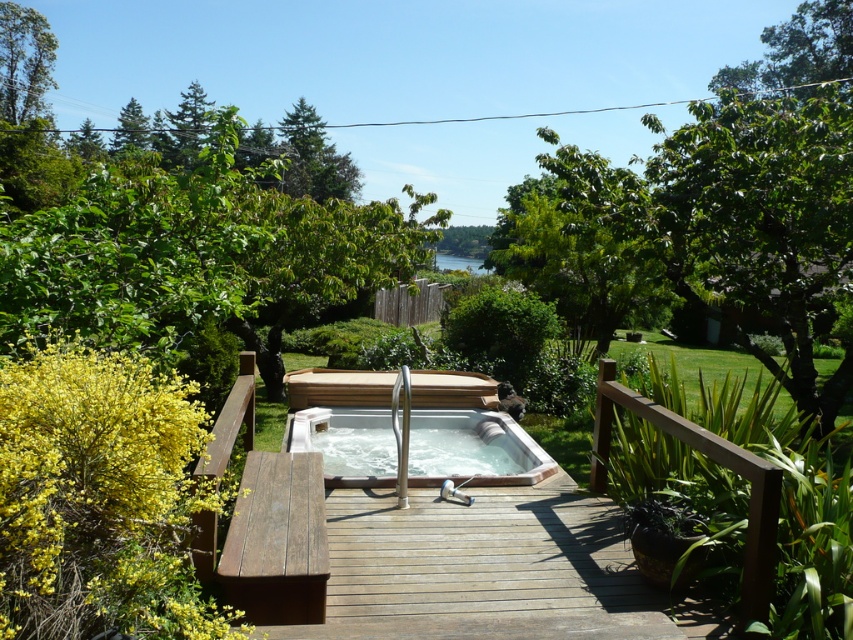
Can you confirm if brown wooden deck at center is taller than white glossy hot tub at center?

Correct, brown wooden deck at center is much taller as white glossy hot tub at center.

Locate an element on the screen. This screenshot has width=853, height=640. brown wooden deck at center is located at coordinates coord(413,560).

Which is behind, point (461, 608) or point (532, 468)?

The point (532, 468) is more distant.

The image size is (853, 640). Identify the location of brown wooden deck at center. (413, 560).

Who is positioned more to the right, white glossy hot tub at center or green leafy tree at upper left?

From the viewer's perspective, white glossy hot tub at center appears more on the right side.

Is point (332, 476) more distant than point (0, 83)?

No, (332, 476) is closer to viewer.

Does point (465, 410) lie behind point (16, 36)?

No.

The image size is (853, 640). Find the location of `white glossy hot tub at center`. white glossy hot tub at center is located at coordinates (476, 420).

Which is below, brown wooden deck at center or green leafy tree at upper left?

Positioned lower is brown wooden deck at center.

Does brown wooden deck at center have a lesser height compared to green leafy tree at upper left?

No, brown wooden deck at center is not shorter than green leafy tree at upper left.

Is point (309, 496) less distant than point (9, 76)?

Yes, point (309, 496) is closer to viewer.

The image size is (853, 640). Find the location of `brown wooden deck at center`. brown wooden deck at center is located at coordinates (413, 560).